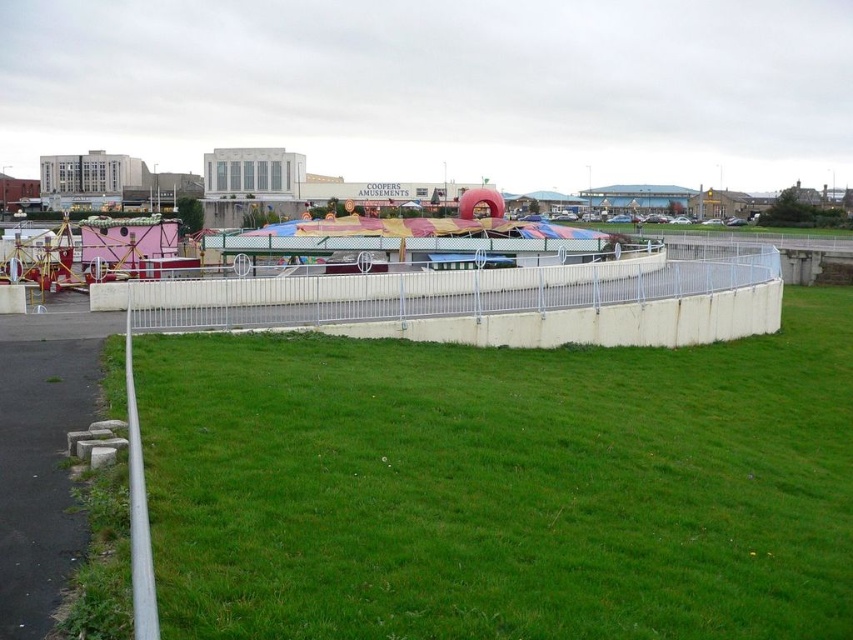
Who is shorter, green grass at center or multicolored fabric carousel at center?

green grass at center

Is green grass at center to the left of multicolored fabric carousel at center from the viewer's perspective?

No, green grass at center is not to the left of multicolored fabric carousel at center.

Is point (572, 436) closer to viewer compared to point (260, 240)?

Yes, it is.

Where is `green grass at center`? This screenshot has height=640, width=853. green grass at center is located at coordinates (502, 484).